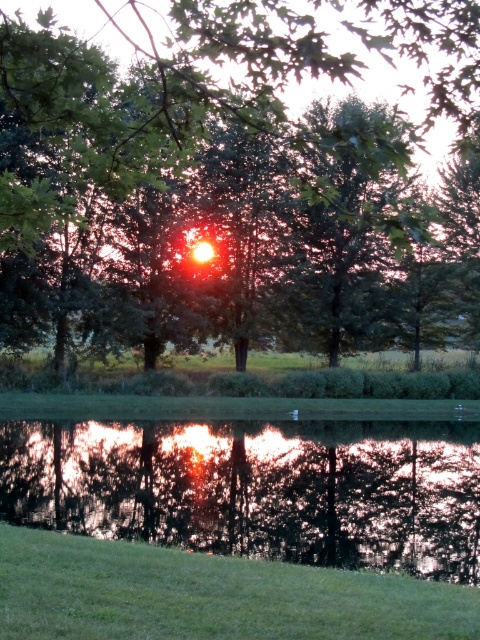
You are standing at the edge of the water and see the green leafy tree at center and the reflective glass water at center. Which object is located above the other?

The green leafy tree at center is positioned over reflective glass water at center.

You are standing on the edge of the water and want to take a photo of both the green leafy tree at center and the reflective glass water at center. Which object should you focus on first to ensure both are in sharp focus?

You should focus on the green leafy tree at center first because it is closer to you than the reflective glass water at center. By focusing on the closer object, the farther one may still be in acceptable focus depending on the aperture used.

You are an artist trying to paint the sunset scene. You want to ensure the green leafy tree at center and the reflective glass water at center are proportionally accurate. Which object should you paint larger?

The green leafy tree at center should be painted larger since it has a larger size compared to the reflective glass water at center according to the description.